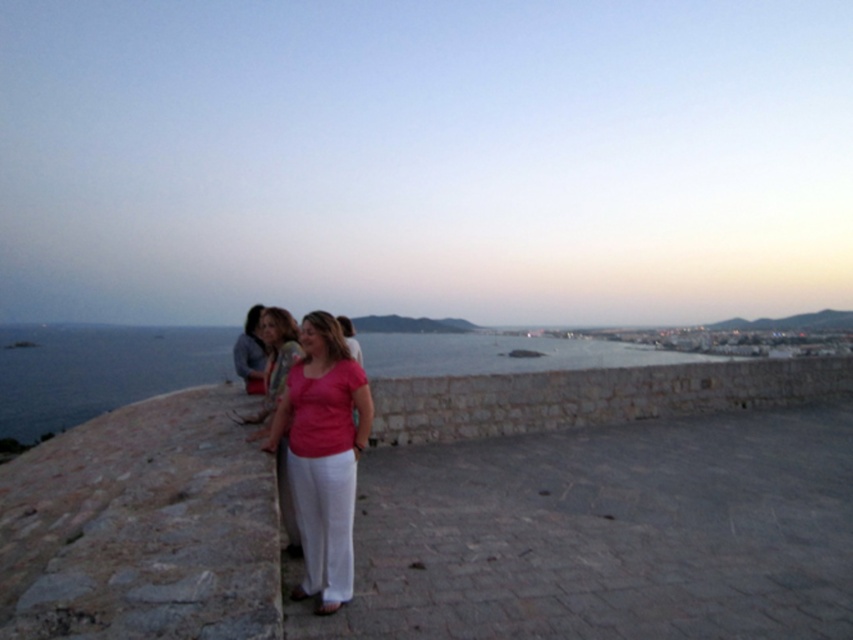
You are a photographer trying to capture the blue water at center and the matte pink shirt at left in the same frame. Which object will appear larger in the photo?

The blue water at center will appear larger in the photo because it is taller than the matte pink shirt at left.

You are a photographer standing at the camera position. You want to take a photo of both point [563,353] and point [347,436] in the scene. Which point is closer to your camera so that you can focus on it first?

Point [563,353] is further to the camera than point [347,436], so the point closer to the camera is point [347,436]. Therefore, you should focus on point [347,436] first.

You are standing at the edge of the stone wall and want to take a photo of the blue water at center and the matte pink shirt at center. Which object should you place on the left side of your camera frame to ensure both are visible?

You should place the blue water at center on the left side of your camera frame since it is already positioned on the left side of the matte pink shirt at center, ensuring both are visible in the frame.